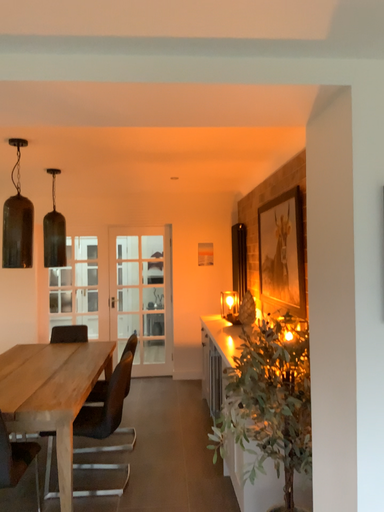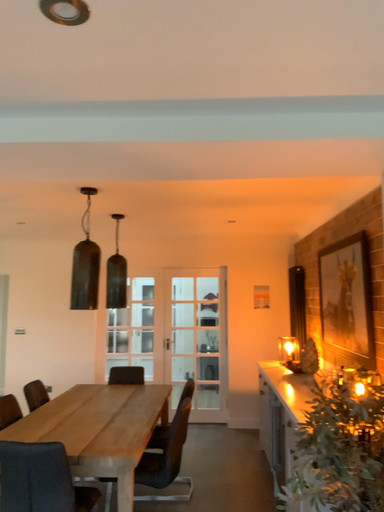
Question: How did the camera likely rotate when shooting the video?

Choices:
 (A) rotated left
 (B) rotated right

Answer: (A)